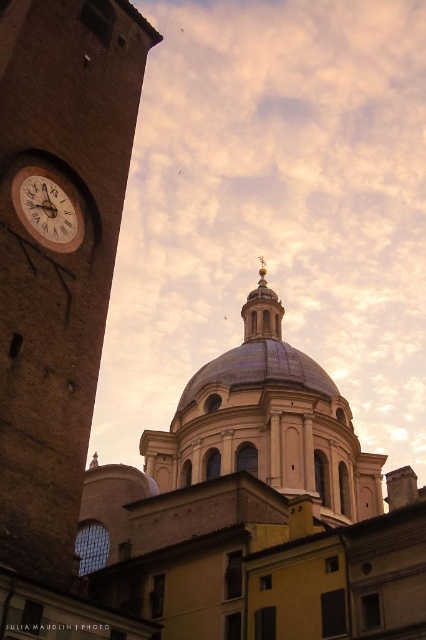
Is smooth white dome at center positioned behind brick tower at left?

Yes, smooth white dome at center is behind brick tower at left.

What do you see at coordinates (258, 515) in the screenshot? I see `smooth white dome at center` at bounding box center [258, 515].

The image size is (426, 640). Identify the location of smooth white dome at center. (258, 515).

From the picture: Between smooth white dome at center and wooden clock face at upper left, which one is positioned higher?

wooden clock face at upper left

Who is more forward, [317,624] or [51,202]?

Point [317,624]

Locate an element on the screen. Image resolution: width=426 pixels, height=640 pixels. smooth white dome at center is located at coordinates (258, 515).

Is wooden clock face at upper left to the left of gold polished dome at center from the viewer's perspective?

Correct, you'll find wooden clock face at upper left to the left of gold polished dome at center.

Who is lower down, wooden clock face at upper left or gold polished dome at center?

gold polished dome at center is below.

Does point (57, 216) come behind point (262, 266)?

No, it is in front of (262, 266).

Identify the location of wooden clock face at upper left. (46, 209).